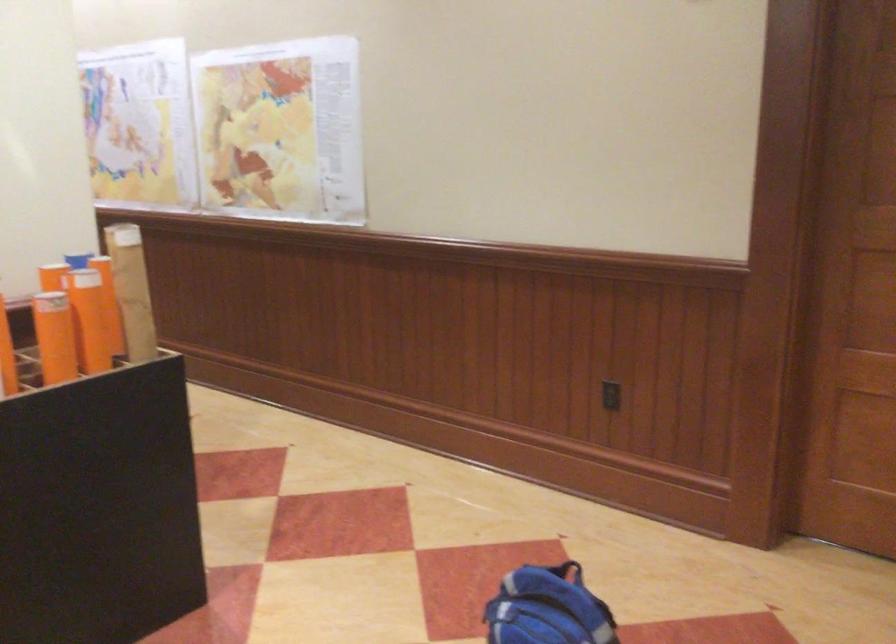
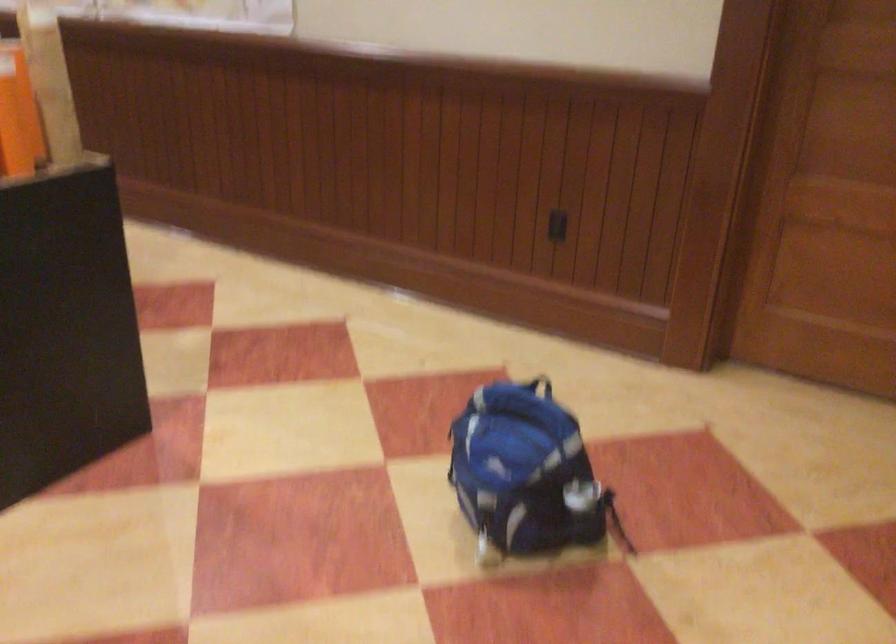
Question: How did the camera likely rotate?

Choices:
 (A) Left
 (B) Right
 (C) Up
 (D) Down

Answer: (D)